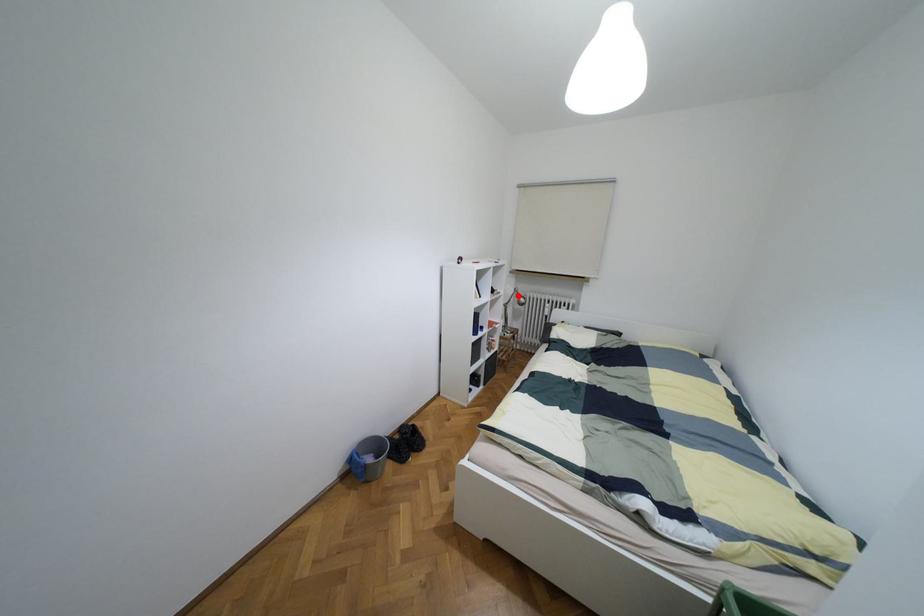
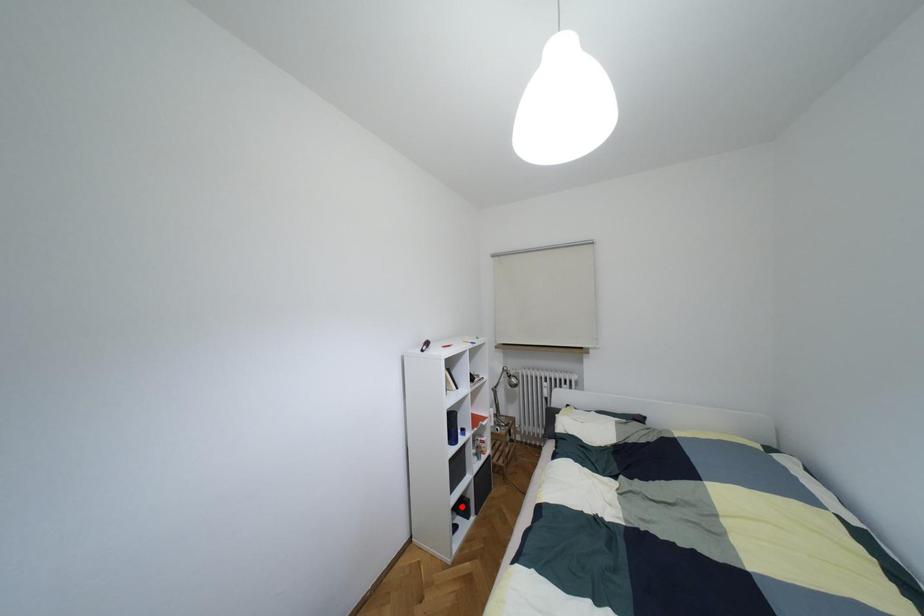
I am providing you with two images of the same scene from different viewpoints. A red point is marked on the first image and another point is marked on the second image. Does the point marked in image1 correspond to the same location as the one in image2?

No